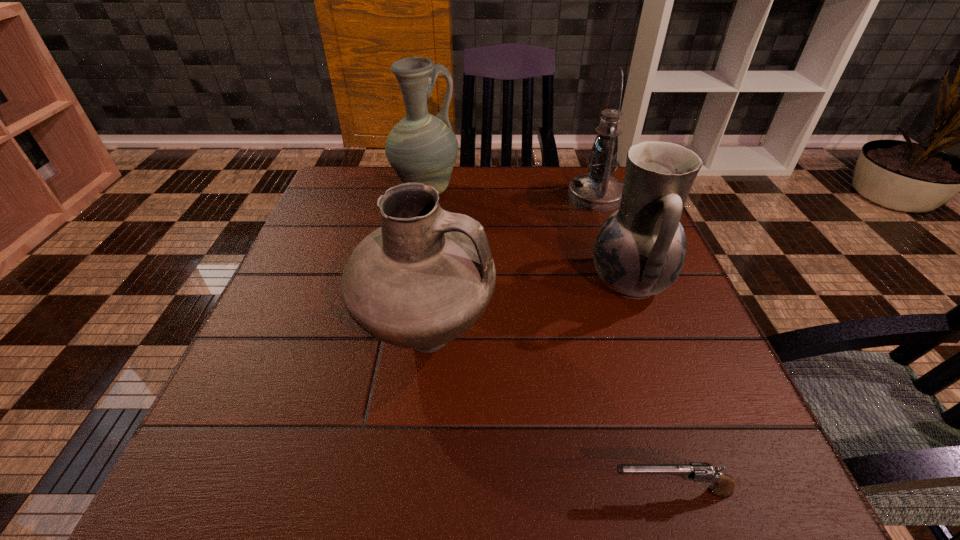
The width and height of the screenshot is (960, 540). I want to click on object that is at the near right corner, so click(723, 486).

The height and width of the screenshot is (540, 960). I want to click on free point at the far edge, so click(x=550, y=199).

In the image, there is a desktop. At what (x,y) coordinates should I click in order to perform the action: click on free space at the near edge. Please return your answer as a coordinate pair (x, y). The width and height of the screenshot is (960, 540). Looking at the image, I should click on (457, 494).

In the image, there is a desktop. Identify the location of free space at the left edge. The width and height of the screenshot is (960, 540). (345, 265).

You are a GUI agent. You are given a task and a screenshot of the screen. Output one action in this format:
    pyautogui.click(x=<x>, y=<y>)
    Task: Click on the vacant point at the right edge
    The height and width of the screenshot is (540, 960).
    Given the screenshot: What is the action you would take?
    pyautogui.click(x=705, y=382)

Locate an element on the screen. The image size is (960, 540). vacant area that lies between the shortest object and the oil lamp is located at coordinates (633, 343).

Where is `vacant region between the shortest object and the rightmost pitcher`? Image resolution: width=960 pixels, height=540 pixels. vacant region between the shortest object and the rightmost pitcher is located at coordinates (650, 387).

Find the location of a particular element. This screenshot has height=540, width=960. empty space between the rightmost pitcher and the farthest pitcher is located at coordinates (528, 237).

Where is `free space between the farthest pitcher and the rightmost pitcher`? free space between the farthest pitcher and the rightmost pitcher is located at coordinates (528, 237).

Image resolution: width=960 pixels, height=540 pixels. I want to click on vacant space that's between the farthest pitcher and the nearest object, so click(x=548, y=341).